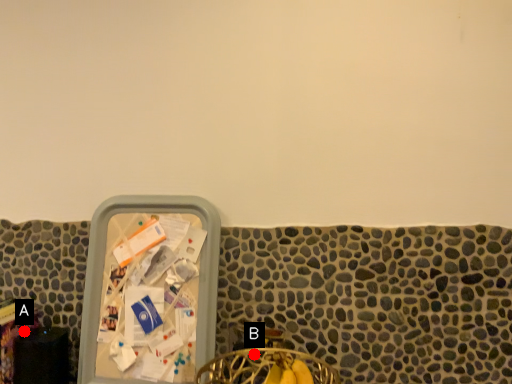
Question: Two points are circled on the image, labeled by A and B beside each circle. Which point is closer to the camera?

Choices:
 (A) A is closer
 (B) B is closer

Answer: (B)